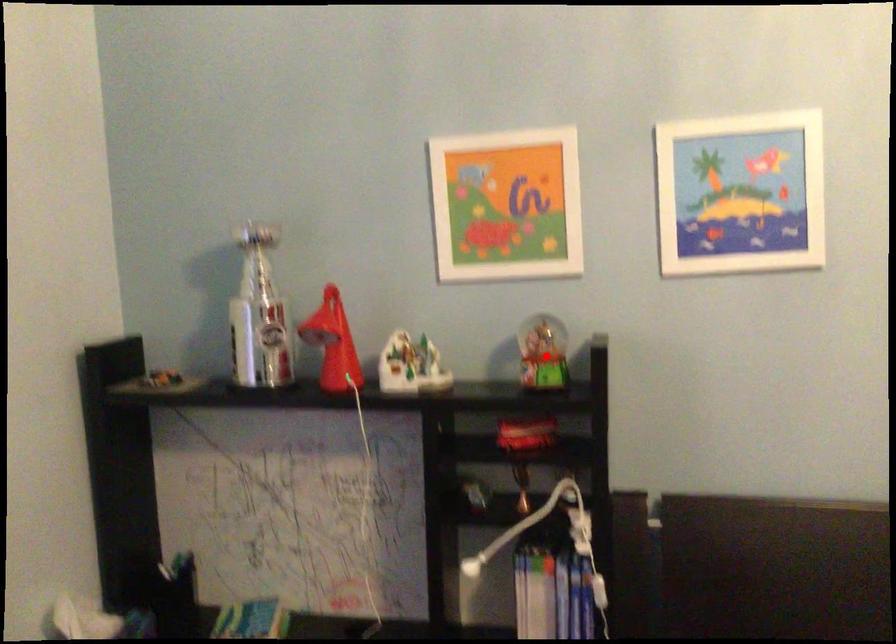
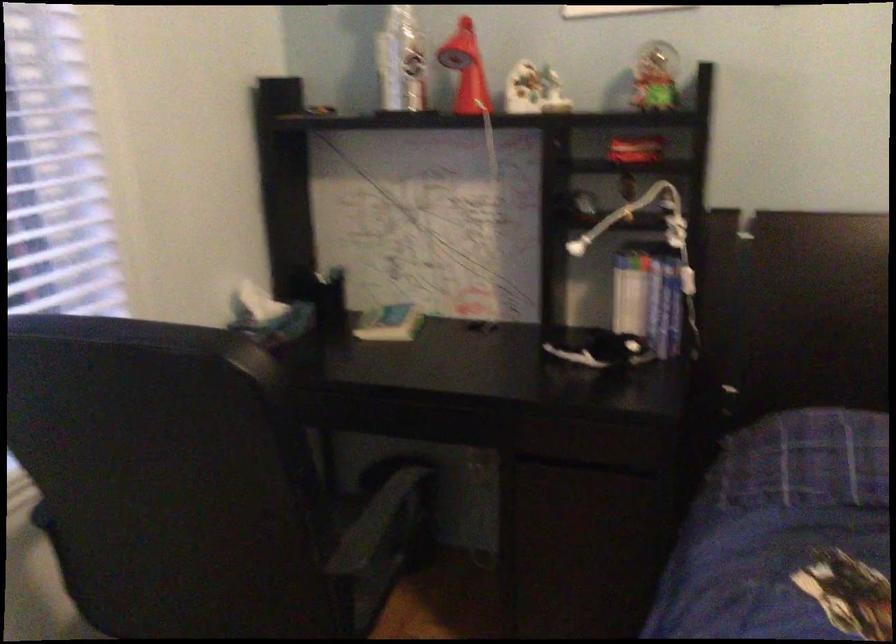
Question: I am providing you with two images of the same scene from different viewpoints. In image1, a red point is highlighted. Considering the same 3D point in image2, which of the following is correct?

Choices:
 (A) It is closer
 (B) It is farther

Answer: (B)